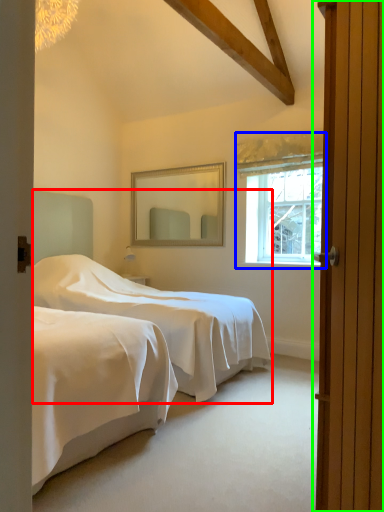
Question: Based on their relative distances, which object is farther from bed (highlighted by a red box)? Choose from window (highlighted by a blue box) and door (highlighted by a green box).

Choices:
 (A) window
 (B) door

Answer: (B)